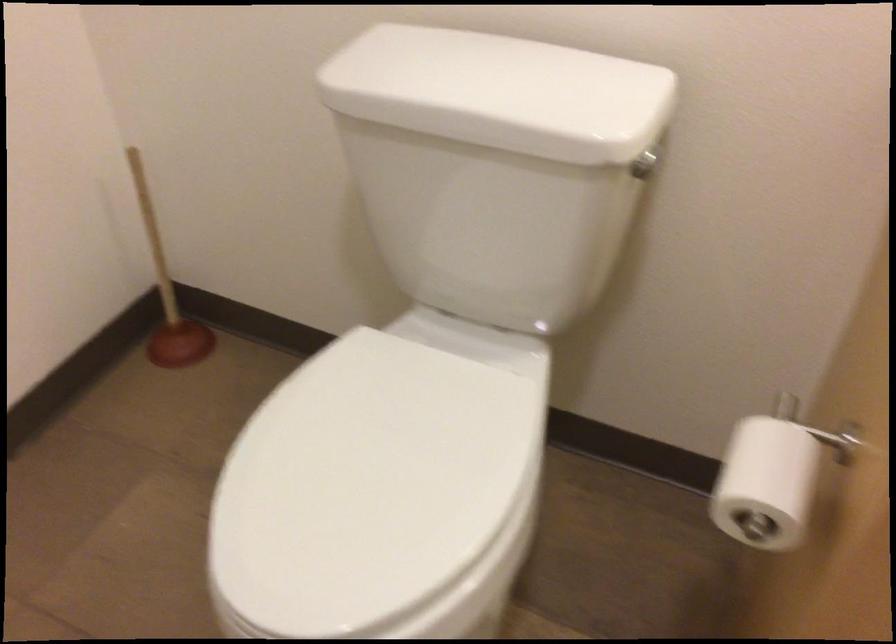
The image size is (896, 644). In order to click on toilet flush handle in this screenshot , I will do `click(643, 165)`.